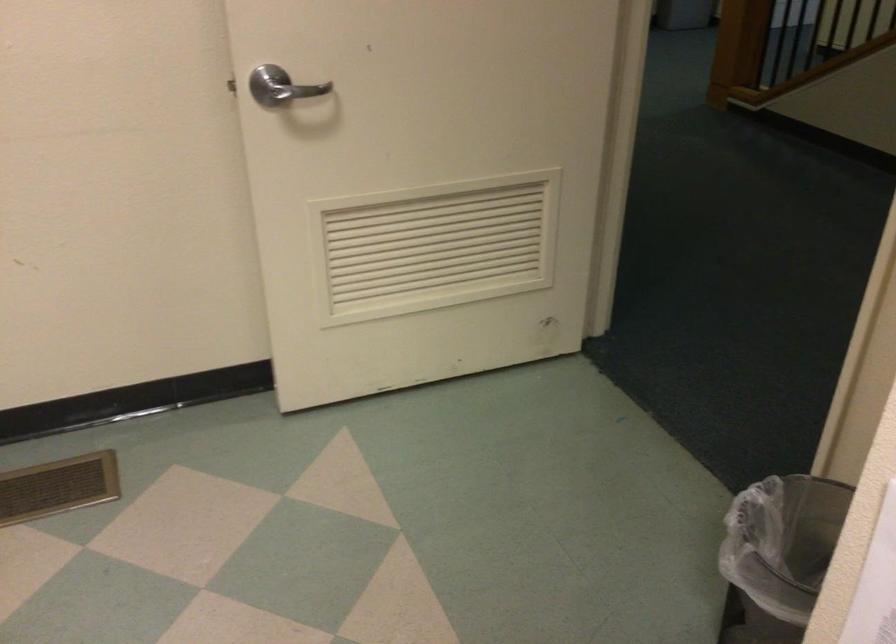
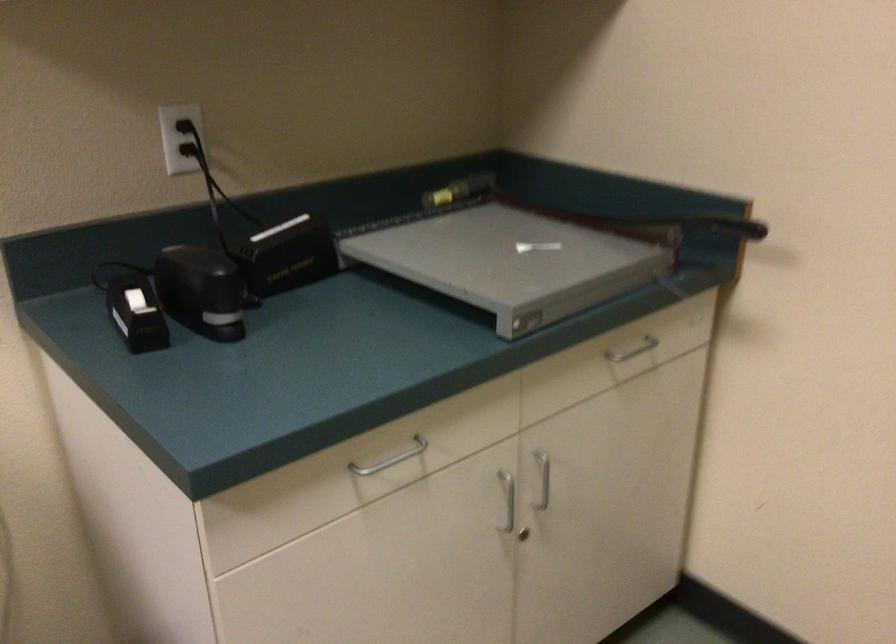
Question: How did the camera likely rotate?

Choices:
 (A) Left
 (B) Right
 (C) Up
 (D) Down

Answer: (A)